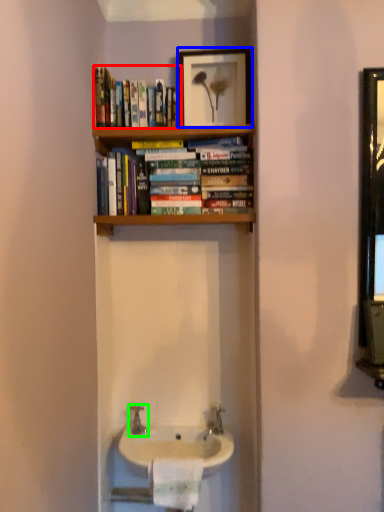
Question: Based on their relative distances, which object is farther from book (highlighted by a red box)? Choose from picture frame (highlighted by a blue box) and tap (highlighted by a green box).

Choices:
 (A) picture frame
 (B) tap

Answer: (B)